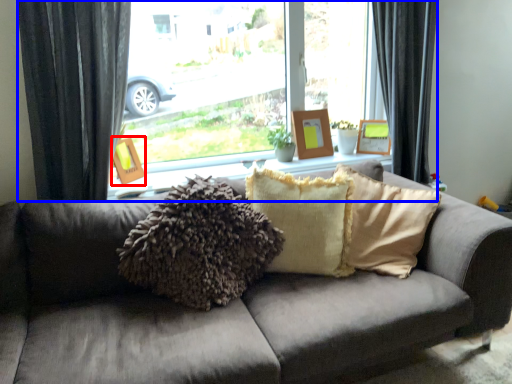
Question: Which point is closer to the camera, picture frame (highlighted by a red box) or window (highlighted by a blue box)?

Choices:
 (A) picture frame
 (B) window

Answer: (B)